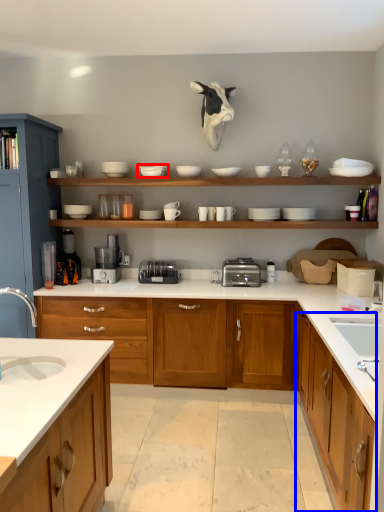
Question: Which object appears farthest to the camera in this image, tableware (highlighted by a red box) or cabinetry (highlighted by a blue box)?

Choices:
 (A) tableware
 (B) cabinetry

Answer: (A)